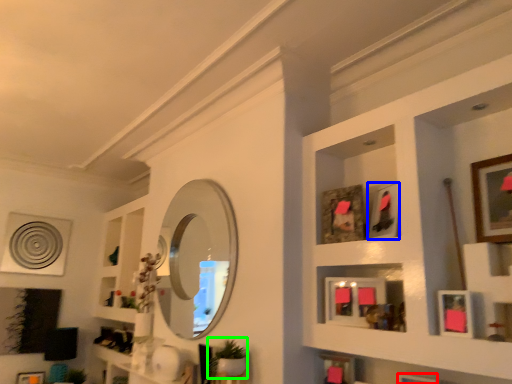
Question: Estimate the real-world distances between objects in this image. Which object is closer to picture frame (highlighted by a red box), picture frame (highlighted by a blue box) or plant (highlighted by a green box)?

Choices:
 (A) picture frame
 (B) plant

Answer: (A)